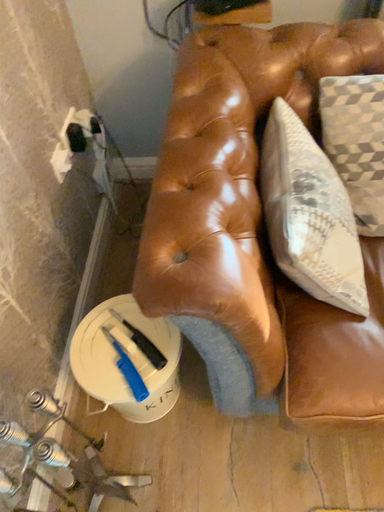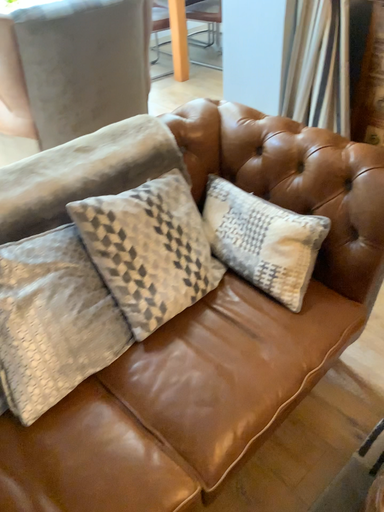
Question: How did the camera likely rotate when shooting the video?

Choices:
 (A) rotated downward
 (B) rotated upward

Answer: (B)